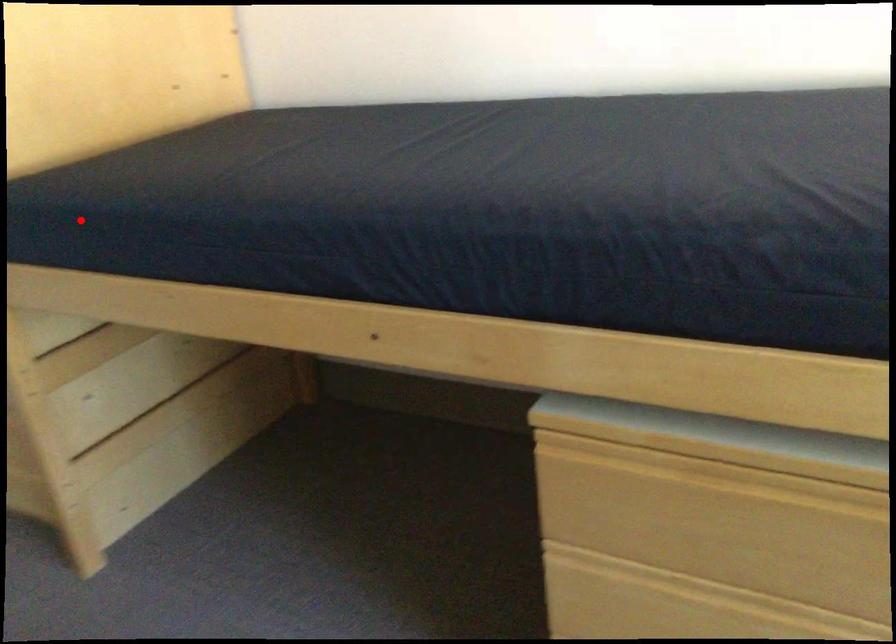
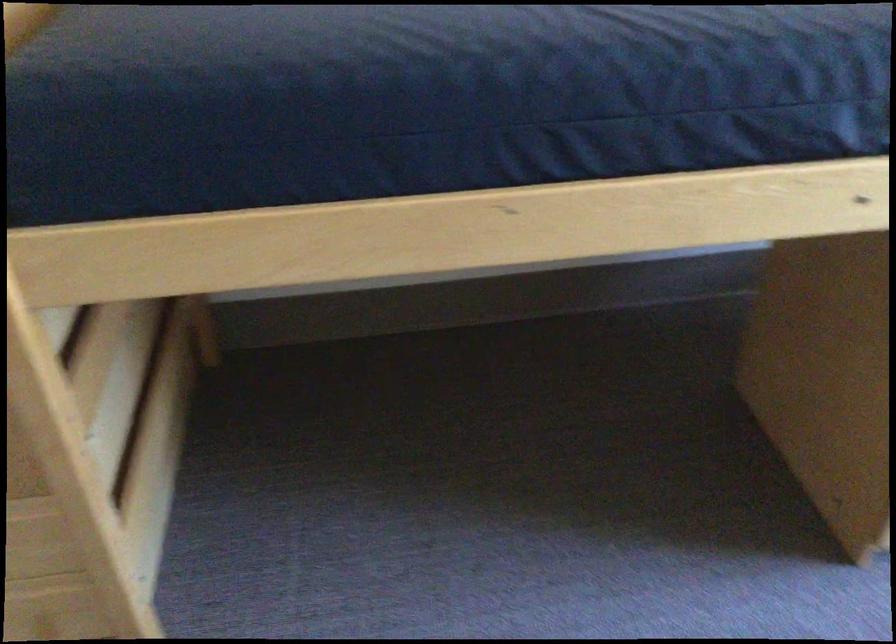
Question: I am providing you with two images of the same scene from different viewpoints. A red point is shown in image1. For the corresponding object point in image2, is it positioned nearer or farther from the camera?

Choices:
 (A) Nearer
 (B) Farther

Answer: (A)